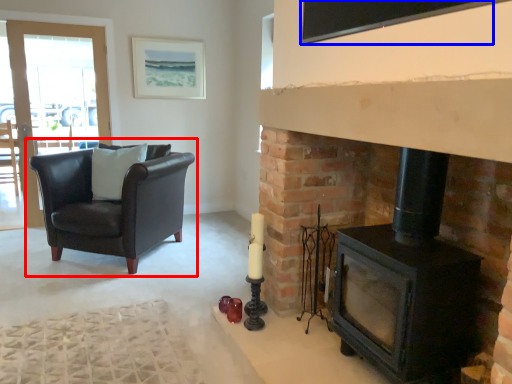
Question: Which object is further to the camera taking this photo, chair (highlighted by a red box) or window screen (highlighted by a blue box)?

Choices:
 (A) chair
 (B) window screen

Answer: (A)